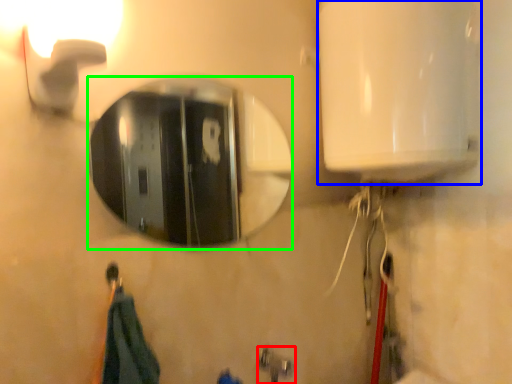
Question: Which object is positioned closest to plumbing fixture (highlighted by a red box)? Select from appliance (highlighted by a blue box) and mirror (highlighted by a green box).

Choices:
 (A) appliance
 (B) mirror

Answer: (A)